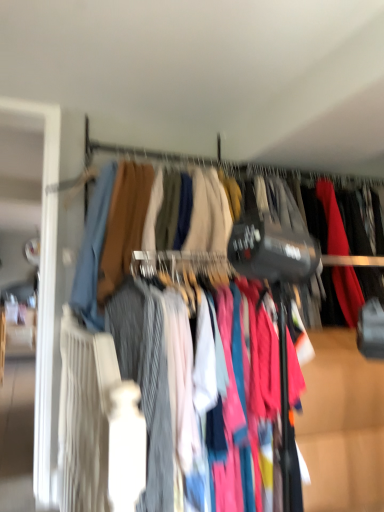
Question: Considering the relative positions of striped cotton pants at center and matte fabric dress at center in the image provided, is striped cotton pants at center to the left or to the right of matte fabric dress at center?

Choices:
 (A) right
 (B) left

Answer: (A)

Question: Would you say striped cotton pants at center is inside or outside matte fabric dress at center?

Choices:
 (A) outside
 (B) inside

Answer: (B)

Question: Which is farther from the matte fabric clothesline at upper center?

Choices:
 (A) matte fabric dress at center
 (B) striped cotton pants at center
 (C) textured fabric clothes at center

Answer: (B)

Question: Estimate the real-world distances between objects in this image. Which object is farther from the striped cotton pants at center?

Choices:
 (A) matte fabric clothesline at upper center
 (B) textured fabric clothes at center
 (C) matte fabric dress at center

Answer: (A)